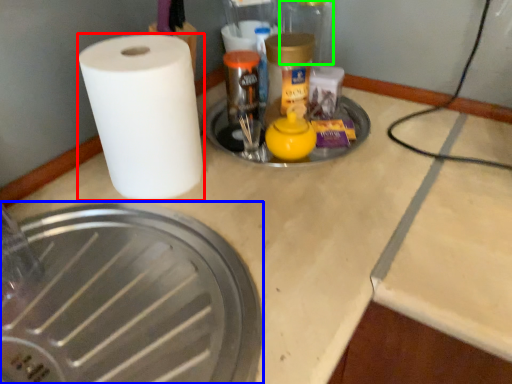
Question: Based on their relative distances, which object is nearer to paper towel (highlighted by a red box)? Choose from manhole cover (highlighted by a blue box) and glass jar (highlighted by a green box).

Choices:
 (A) manhole cover
 (B) glass jar

Answer: (A)